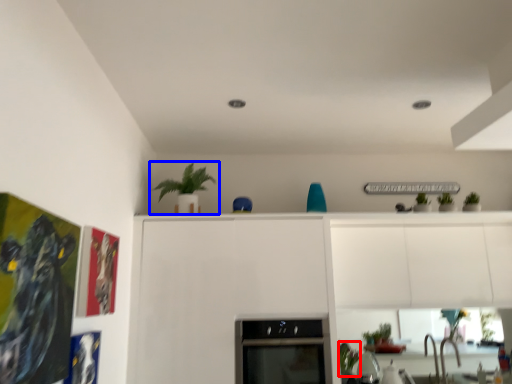
Question: Which object is closer to the camera taking this photo, plant (highlighted by a red box) or houseplant (highlighted by a blue box)?

Choices:
 (A) plant
 (B) houseplant

Answer: (B)